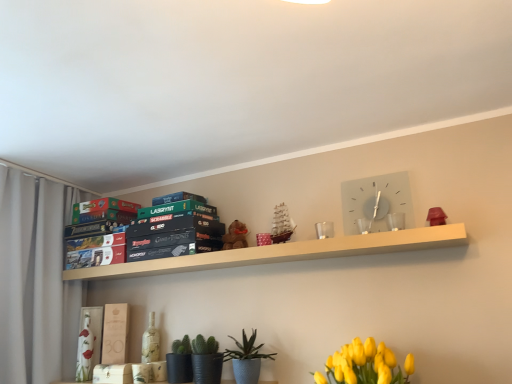
Question: Relative to green matte cactus at lower center, the 2th plant from the right, is matte white book at center, which appears as the 4th paperback book when viewed from the top, in front or behind?

Choices:
 (A) front
 (B) behind

Answer: (B)

Question: Looking at the image, does matte white book at center, which is the 1th paperback book from bottom to top, seem bigger or smaller compared to green matte cactus at lower center, which appears as the 1th plant when viewed from the left?

Choices:
 (A) big
 (B) small

Answer: (B)

Question: Based on their relative distances, which object is nearer to the matte white book at center, which appears as the 4th paperback book when viewed from the top?

Choices:
 (A) green matte board game at upper center, the fourth paperback book when ordered from bottom to top
 (B) yellow matte flower at lower right
 (C) green matte cactus at lower center, which appears as the 1th plant when viewed from the left
 (D) brown plush bear at center
 (E) matte board game at upper left, the second paperback book from the bottom

Answer: (E)

Question: Based on their relative distances, which object is farther from the textured blue pot at lower center, the 2th plant positioned from the left?

Choices:
 (A) green matte board game at upper center, the fourth paperback book when ordered from bottom to top
 (B) green matte board game at upper left, the 2th paperback book viewed from the top
 (C) white glass clock at upper center
 (D) brown plush bear at center
 (E) white fabric curtain at left

Answer: (E)